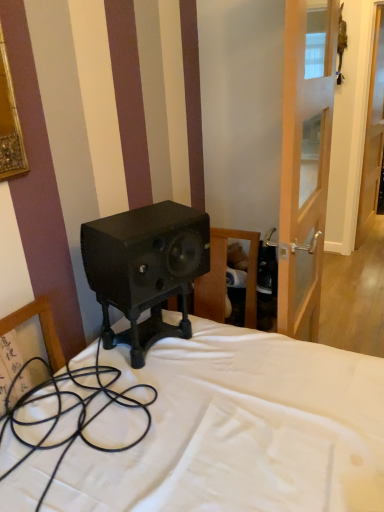
Question: From a real-world perspective, is matte black speaker at center over transparent glass door at right?

Choices:
 (A) no
 (B) yes

Answer: (A)

Question: Can you confirm if matte black speaker at center is shorter than transparent glass door at right?

Choices:
 (A) no
 (B) yes

Answer: (B)

Question: Does matte black speaker at center have a smaller size compared to transparent glass door at right?

Choices:
 (A) yes
 (B) no

Answer: (A)

Question: Is matte black speaker at center not inside transparent glass door at right?

Choices:
 (A) no
 (B) yes

Answer: (B)

Question: Is matte black speaker at center thinner than transparent glass door at right?

Choices:
 (A) yes
 (B) no

Answer: (B)

Question: From their relative heights in the image, would you say transparent glass door at right is taller or shorter than black rubber cable at lower left?

Choices:
 (A) tall
 (B) short

Answer: (A)

Question: From a real-world perspective, relative to black rubber cable at lower left, is transparent glass door at right vertically above or below?

Choices:
 (A) below
 (B) above

Answer: (B)

Question: Would you say transparent glass door at right is inside or outside black rubber cable at lower left?

Choices:
 (A) outside
 (B) inside

Answer: (A)

Question: From the image's perspective, is transparent glass door at right above or below black rubber cable at lower left?

Choices:
 (A) below
 (B) above

Answer: (B)

Question: In the image, is black rubber cable at lower left on the left side or the right side of transparent glass door at right?

Choices:
 (A) left
 (B) right

Answer: (A)

Question: Is black rubber cable at lower left situated inside transparent glass door at right or outside?

Choices:
 (A) inside
 (B) outside

Answer: (B)

Question: Is black rubber cable at lower left wider or thinner than transparent glass door at right?

Choices:
 (A) thin
 (B) wide

Answer: (B)

Question: From the image's perspective, relative to transparent glass door at right, is black rubber cable at lower left above or below?

Choices:
 (A) above
 (B) below

Answer: (B)

Question: Is point (124, 246) closer or farther from the camera than point (377, 118)?

Choices:
 (A) farther
 (B) closer

Answer: (B)

Question: From the image's perspective, relative to transparent glass door at right, is matte black speaker at center above or below?

Choices:
 (A) above
 (B) below

Answer: (B)